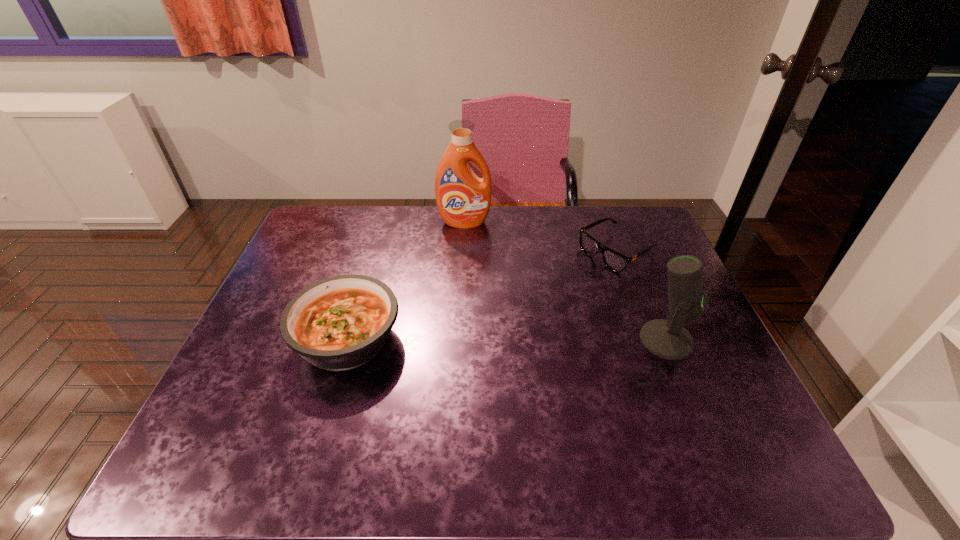
Image resolution: width=960 pixels, height=540 pixels. I want to click on vacant space on the desktop that is between the stew and the microphone and is positioned on the front-facing side of the third nearest object, so click(466, 339).

Image resolution: width=960 pixels, height=540 pixels. I want to click on vacant space on the desktop that is between the third tallest object and the microphone and is positioned on the front-facing side of the second object from left to right, so click(469, 339).